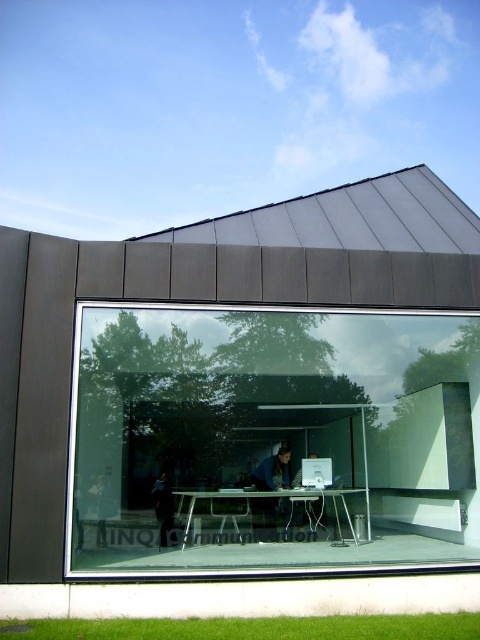
Does metallic silver table at center appear on the left side of white glossy computer at center?

Indeed, metallic silver table at center is positioned on the left side of white glossy computer at center.

This screenshot has height=640, width=480. What do you see at coordinates (277, 499) in the screenshot? I see `metallic silver table at center` at bounding box center [277, 499].

Image resolution: width=480 pixels, height=640 pixels. In order to click on metallic silver table at center in this screenshot , I will do `click(277, 499)`.

Is point (85, 548) in front of point (164, 474)?

Yes, it is in front of point (164, 474).

Is transparent glass door at center wider than dark blue fabric jacket at center?

Indeed, transparent glass door at center has a greater width compared to dark blue fabric jacket at center.

Who is more distant from viewer, (201,440) or (168,522)?

The point (201,440) is more distant.

This screenshot has width=480, height=640. Identify the location of transparent glass door at center. (276, 435).

Is point (264, 500) farther from camera compared to point (103, 508)?

Yes, it is.

Can you confirm if dark blue fabric at center is positioned to the left of dark gray jacket at lower left?

No, dark blue fabric at center is not to the left of dark gray jacket at lower left.

Find the location of a particular element. Image resolution: width=480 pixels, height=640 pixels. dark blue fabric at center is located at coordinates (273, 472).

Locate an element on the screen. dark blue fabric at center is located at coordinates (273, 472).